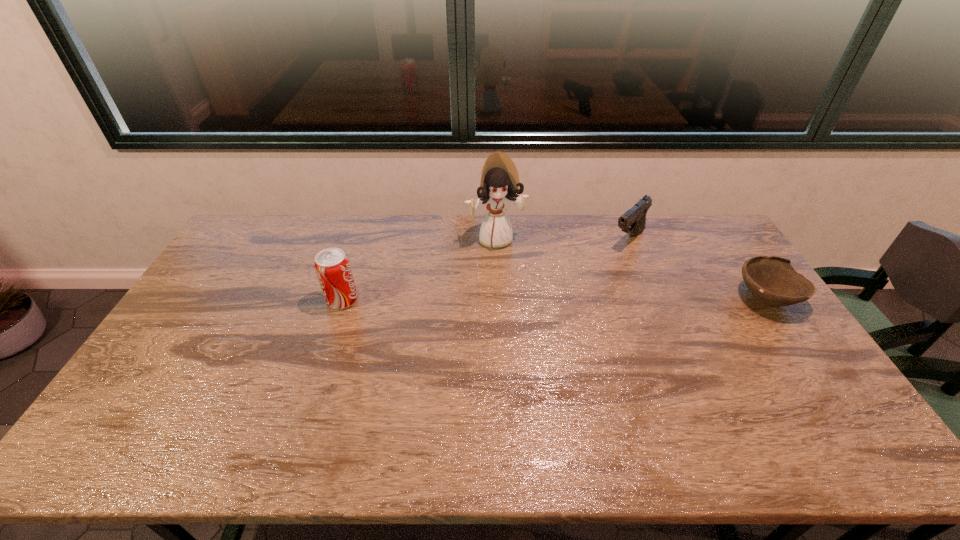
At what (x,y) coordinates should I click in order to perform the action: click on vacant space on the desktop that is between the leftmost object and the shortest object and is positioned at the barrel of the second object from right to left. Please return your answer as a coordinate pair (x, y). The image size is (960, 540). Looking at the image, I should click on (564, 299).

The width and height of the screenshot is (960, 540). Identify the location of free space on the desktop that is between the soda can and the bowl and is positioned at the front face of the tallest object. (516, 299).